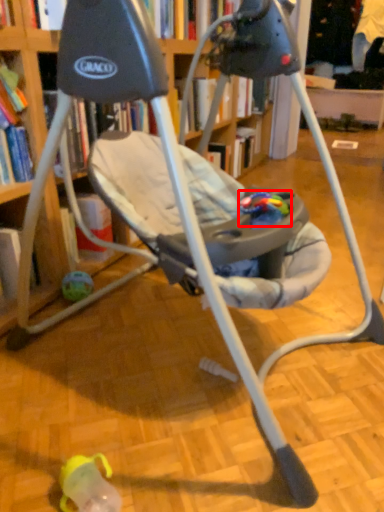
Question: From the image's perspective, what is the correct spatial positioning of toy (annotated by the red box) in reference to toy?

Choices:
 (A) above
 (B) below

Answer: (A)